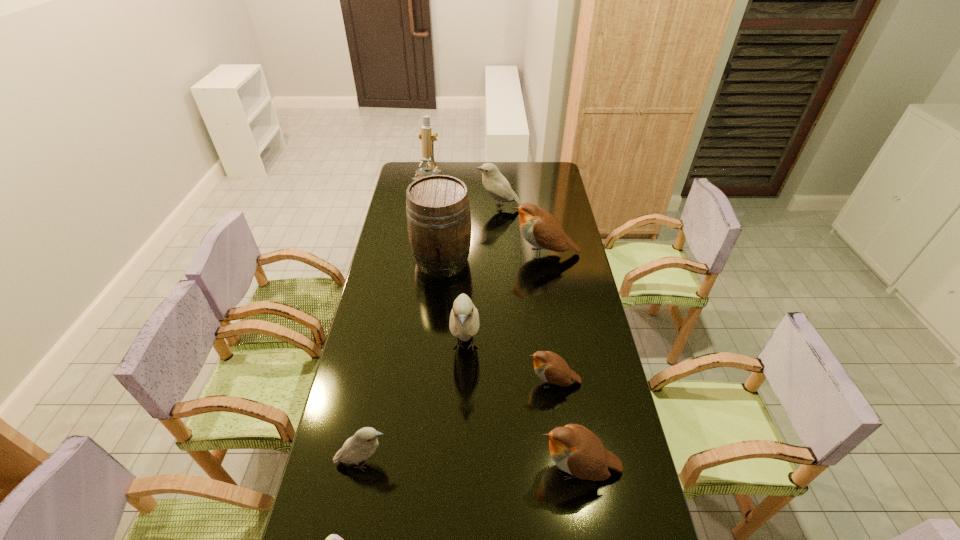
Find the location of `microscope`. microscope is located at coordinates (425, 134).

At what (x,y) coordinates should I click in order to perform the action: click on cider. Please return your answer as a coordinate pair (x, y). This screenshot has width=960, height=540. Looking at the image, I should click on (438, 214).

The image size is (960, 540). What are the coordinates of `the biggest white bird` in the screenshot? It's located at (464, 319).

Locate an element on the screen. The image size is (960, 540). the second nearest white bird is located at coordinates (464, 319).

Where is `the fifth nearest bird`? The height and width of the screenshot is (540, 960). the fifth nearest bird is located at coordinates (541, 229).

Find the location of a particular element. The height and width of the screenshot is (540, 960). the biggest brown bird is located at coordinates (541, 229).

Locate an element on the screen. The image size is (960, 540). the second smallest white bird is located at coordinates (494, 182).

Locate an element on the screen. This screenshot has width=960, height=540. the farthest bird is located at coordinates (494, 182).

Identify the location of the second smallest brown bird. (576, 450).

What are the coordinates of `the leftmost white bird` in the screenshot? It's located at (364, 443).